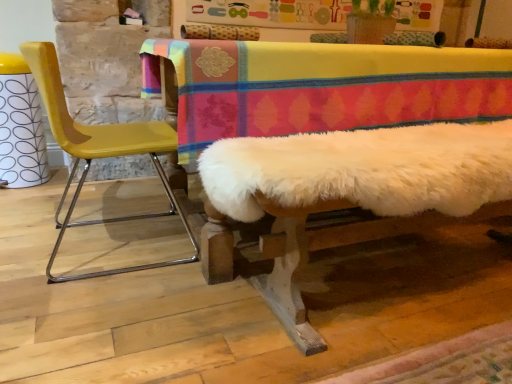
At what (x,y) coordinates should I click in order to perform the action: click on free space in front of yellow fabric chair at left. Please return your answer as a coordinate pair (x, y). Looking at the image, I should click on (101, 316).